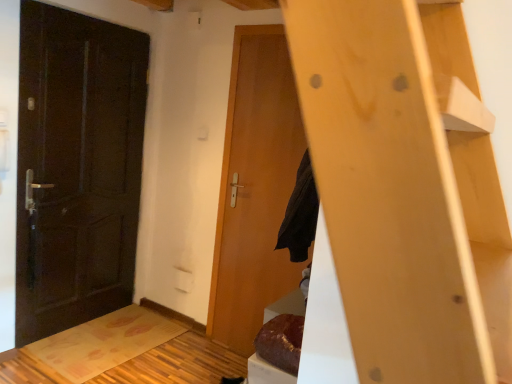
Locate an element on the screen. This screenshot has width=512, height=384. free space in front of matte dark brown door at left, acting as the 2th door starting from the right is located at coordinates (67, 361).